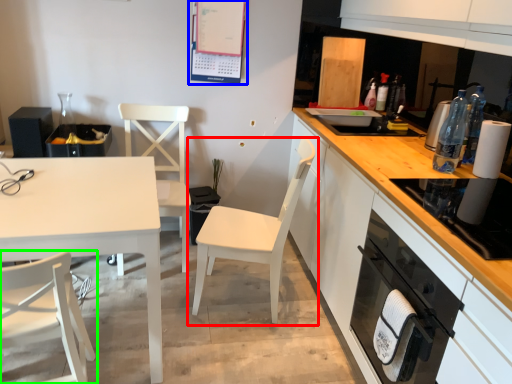
Question: Considering the real-world distances, which object is closest to chair (highlighted by a red box)? bulletin board (highlighted by a blue box) or chair (highlighted by a green box).

Choices:
 (A) bulletin board
 (B) chair

Answer: (B)